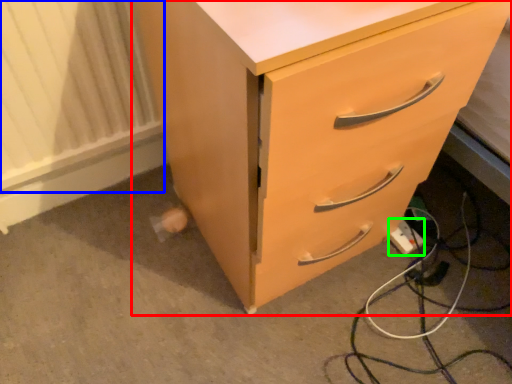
Question: Estimate the real-world distances between objects in this image. Which object is farther from chest of drawers (highlighted by a red box), radiator (highlighted by a blue box) or extension cord (highlighted by a green box)?

Choices:
 (A) radiator
 (B) extension cord

Answer: (B)